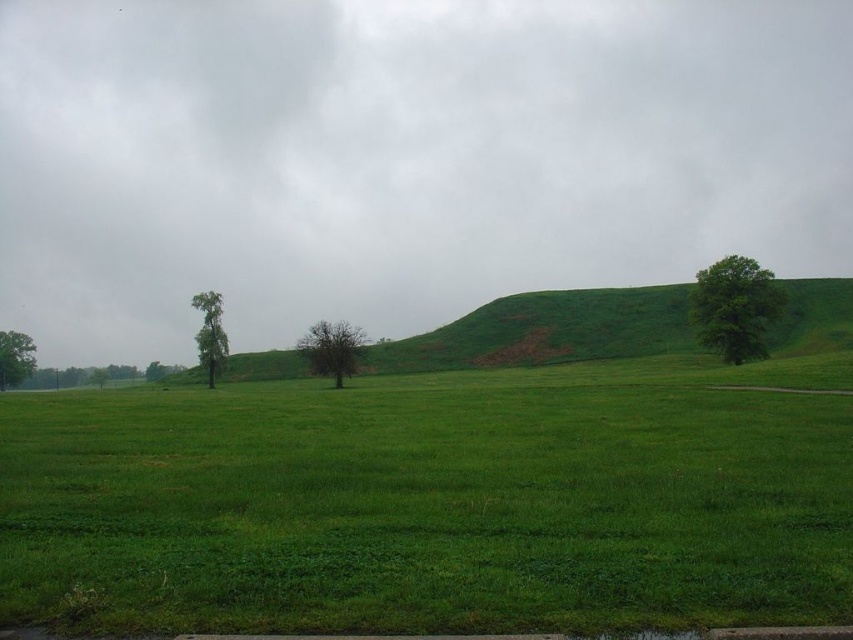
Question: Is green grassy field at center closer to the viewer compared to green leafy tree at lower left?

Choices:
 (A) no
 (B) yes

Answer: (B)

Question: Can you confirm if green grassy field at center is thinner than green leafy tree at left?

Choices:
 (A) no
 (B) yes

Answer: (A)

Question: Is green leafy tree at left to the left of green leafy tree at lower left from the viewer's perspective?

Choices:
 (A) yes
 (B) no

Answer: (B)

Question: Among these objects, which one is nearest to the camera?

Choices:
 (A) green grassy field at center
 (B) green leafy tree at left
 (C) green grassy hillside at center

Answer: (A)

Question: Which is nearer to the green leafy tree at left?

Choices:
 (A) green grassy field at center
 (B) green leafy tree at right
 (C) green leafy tree at lower left

Answer: (A)

Question: Which point is closer to the camera?

Choices:
 (A) (669, 504)
 (B) (341, 376)
 (C) (212, 365)
 (D) (630, 300)

Answer: (A)